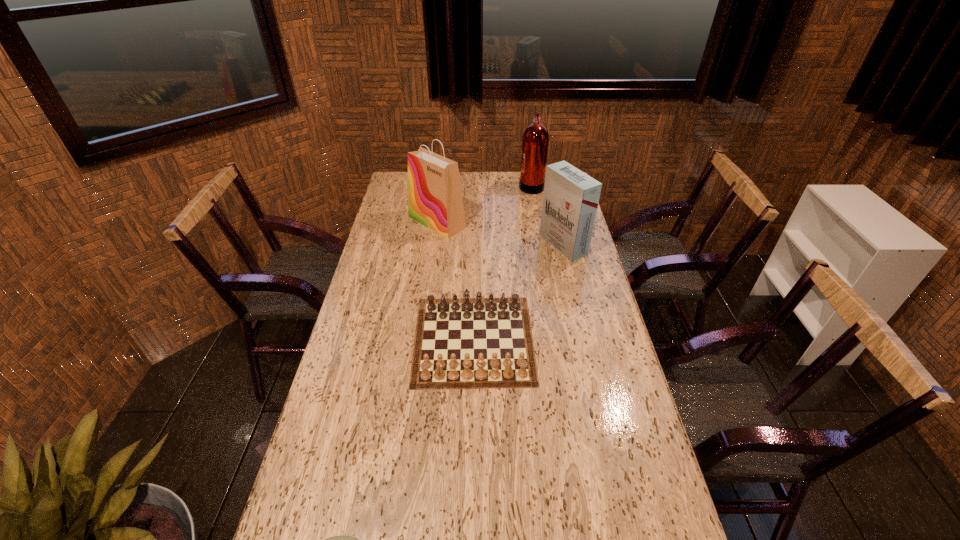
The width and height of the screenshot is (960, 540). I want to click on the farthest object, so click(535, 141).

Locate an element on the screen. The width and height of the screenshot is (960, 540). shopping bag is located at coordinates (435, 200).

You are a GUI agent. You are given a task and a screenshot of the screen. Output one action in this format:
    pyautogui.click(x=<x>, y=<y>)
    Task: Click on the cigarette case
    The height and width of the screenshot is (540, 960).
    Given the screenshot: What is the action you would take?
    pyautogui.click(x=570, y=200)

Where is `chessboard`? chessboard is located at coordinates (485, 344).

Identify the location of vacant space located 0.120m on the front-facing side of the farthest object. This screenshot has height=540, width=960. (494, 185).

This screenshot has width=960, height=540. I want to click on vacant space located 0.290m on the front-facing side of the farthest object, so click(460, 185).

I want to click on vacant space located on the front-facing side of the farthest object, so click(x=486, y=185).

Where is `free region located on the back of the shopping bag`? The height and width of the screenshot is (540, 960). free region located on the back of the shopping bag is located at coordinates (441, 195).

Where is `vacant space located 0.080m on the back of the cigarette case`? The height and width of the screenshot is (540, 960). vacant space located 0.080m on the back of the cigarette case is located at coordinates (557, 218).

This screenshot has height=540, width=960. Find the location of `vacant point located 0.360m on the back of the fourth farthest object`. vacant point located 0.360m on the back of the fourth farthest object is located at coordinates (475, 238).